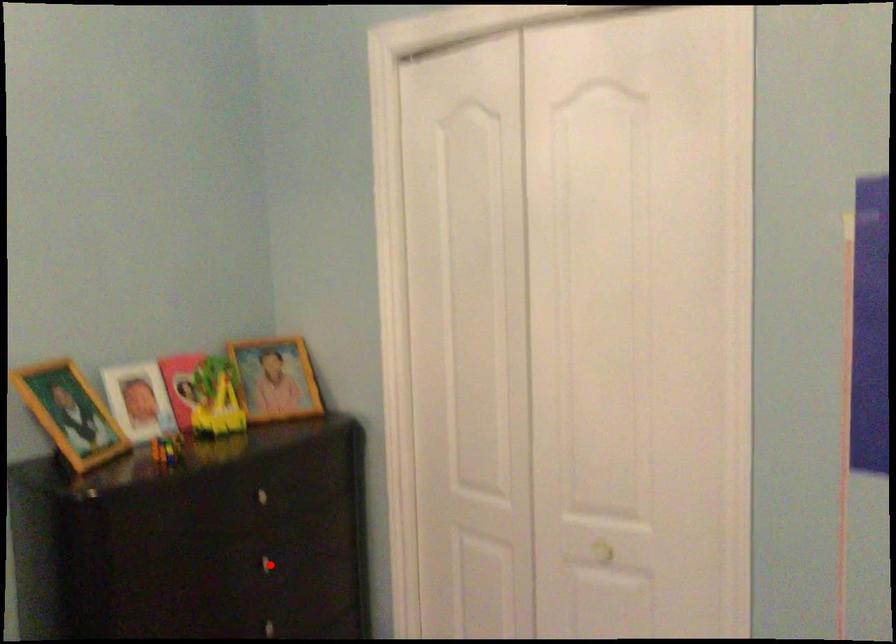
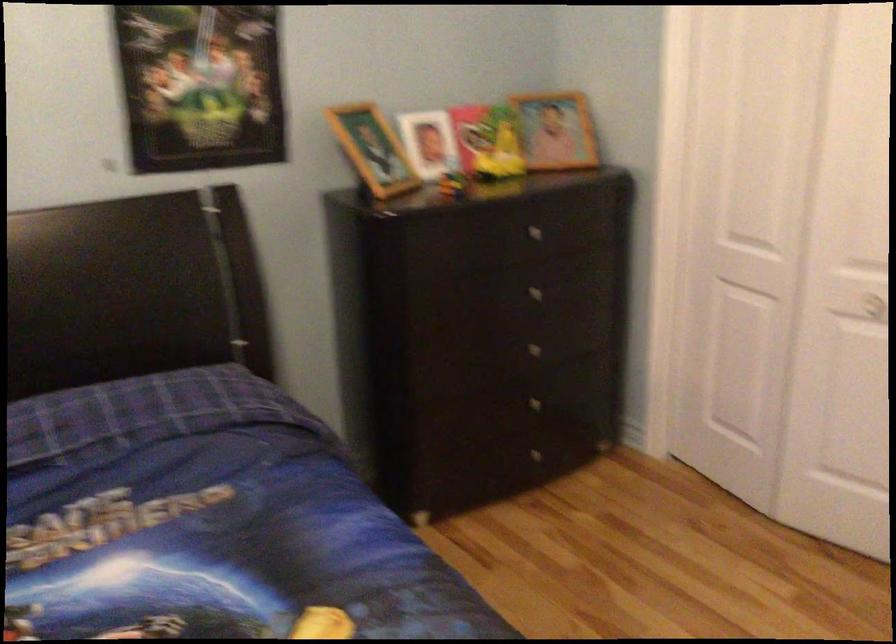
Question: I am providing you with two images of the same scene from different viewpoints. A red point is shown in image1. For the corresponding object point in image2, is it positioned nearer or farther from the camera?

Choices:
 (A) Nearer
 (B) Farther

Answer: (B)